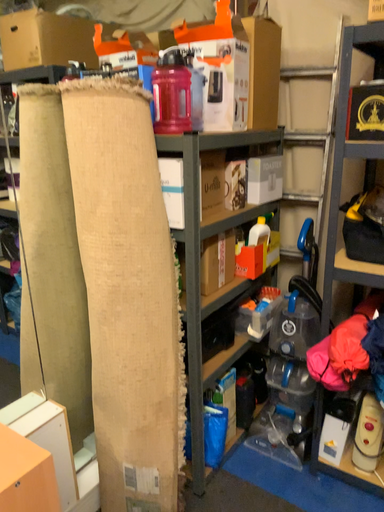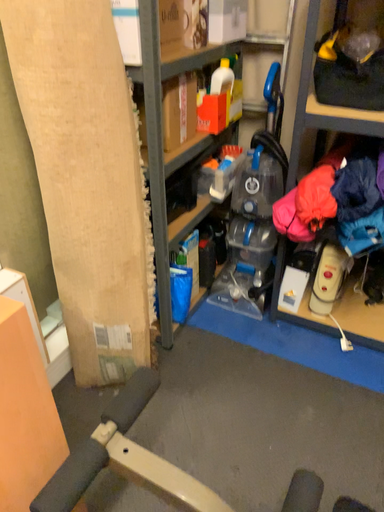
Question: Which way did the camera rotate in the video?

Choices:
 (A) rotated left
 (B) rotated right

Answer: (B)